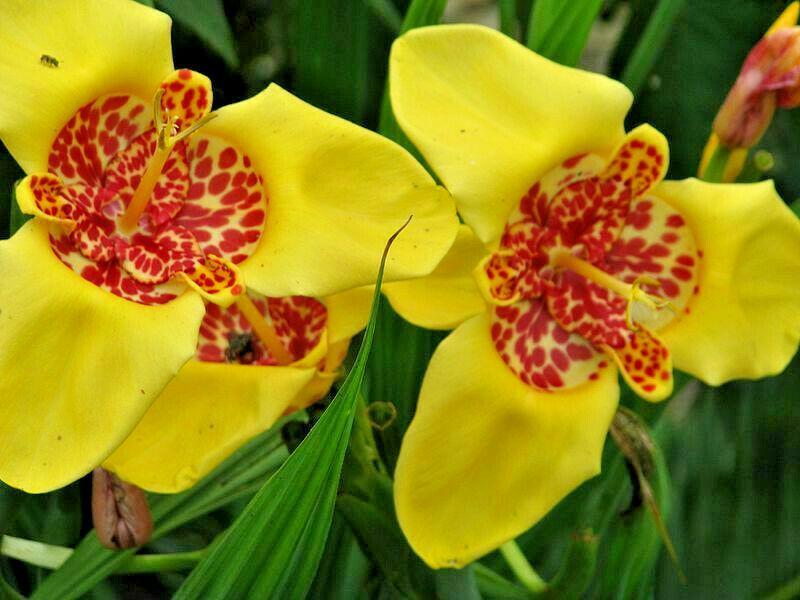
The width and height of the screenshot is (800, 600). What are the coordinates of `dried up flower` in the screenshot? It's located at (130, 508).